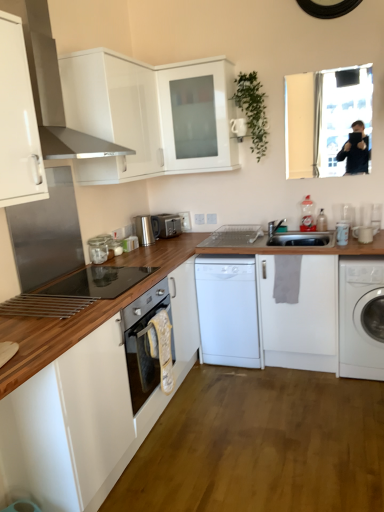
Identify the location of vacant space situated on the left part of white glossy mug at right, which is the 1th appliance from front to back. The image size is (384, 512). (330, 244).